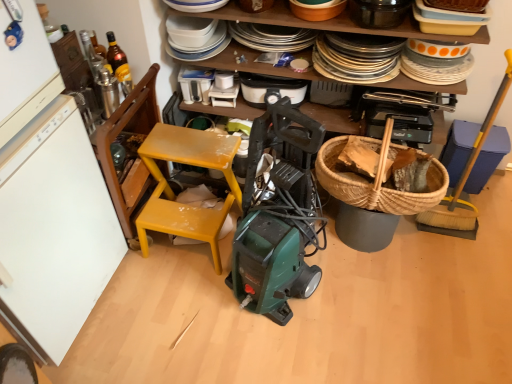
Question: From the image's perspective, is yellow plastic broom at right, which is the sixth appliance from left to right, located above wooden plate rack at upper center, the first shelf viewed from the back?

Choices:
 (A) yes
 (B) no

Answer: (B)

Question: Can you confirm if yellow plastic broom at right, which is counted as the 2th appliance, starting from the right, is smaller than wooden plate rack at upper center, placed as the second shelf when sorted from front to back?

Choices:
 (A) yes
 (B) no

Answer: (A)

Question: Considering the relative positions of yellow plastic broom at right, which is counted as the 2th appliance, starting from the right, and wooden plate rack at upper center, placed as the second shelf when sorted from front to back, in the image provided, is yellow plastic broom at right, which is counted as the 2th appliance, starting from the right, to the left of wooden plate rack at upper center, placed as the second shelf when sorted from front to back, from the viewer's perspective?

Choices:
 (A) yes
 (B) no

Answer: (B)

Question: Is yellow plastic broom at right, which is counted as the 2th appliance, starting from the right, completely or partially outside of wooden plate rack at upper center, the first shelf viewed from the back?

Choices:
 (A) yes
 (B) no

Answer: (A)

Question: Is yellow plastic broom at right, which is the sixth appliance from left to right, directly adjacent to wooden plate rack at upper center, the first shelf viewed from the back?

Choices:
 (A) no
 (B) yes

Answer: (A)

Question: Is yellow plastic broom at right, which is counted as the 2th appliance, starting from the right, thinner than wooden plate rack at upper center, the first shelf viewed from the back?

Choices:
 (A) no
 (B) yes

Answer: (B)

Question: Does black plastic vacuum cleaner at center, placed as the fourth appliance when sorted from left to right, have a lesser height compared to blue plastic trash can at right, the seventh appliance from the left?

Choices:
 (A) yes
 (B) no

Answer: (A)

Question: Is black plastic vacuum cleaner at center, arranged as the 4th appliance when viewed from the right, bigger than blue plastic trash can at right, which is counted as the first appliance, starting from the right?

Choices:
 (A) yes
 (B) no

Answer: (B)

Question: Is black plastic vacuum cleaner at center, placed as the fourth appliance when sorted from left to right, placed right next to blue plastic trash can at right, the seventh appliance from the left?

Choices:
 (A) no
 (B) yes

Answer: (A)

Question: From the image's perspective, would you say black plastic vacuum cleaner at center, arranged as the 4th appliance when viewed from the right, is shown under blue plastic trash can at right, which is counted as the first appliance, starting from the right?

Choices:
 (A) no
 (B) yes

Answer: (A)

Question: Is blue plastic trash can at right, which is counted as the first appliance, starting from the right, surrounded by black plastic vacuum cleaner at center, arranged as the 4th appliance when viewed from the right?

Choices:
 (A) yes
 (B) no

Answer: (B)

Question: Considering the relative positions of black plastic vacuum cleaner at center, arranged as the 4th appliance when viewed from the right, and blue plastic trash can at right, the seventh appliance from the left, in the image provided, is black plastic vacuum cleaner at center, arranged as the 4th appliance when viewed from the right, to the right of blue plastic trash can at right, the seventh appliance from the left, from the viewer's perspective?

Choices:
 (A) no
 (B) yes

Answer: (A)

Question: Would you say woven brown picnic basket at right is outside translucent glass bottle at upper left?

Choices:
 (A) no
 (B) yes

Answer: (B)